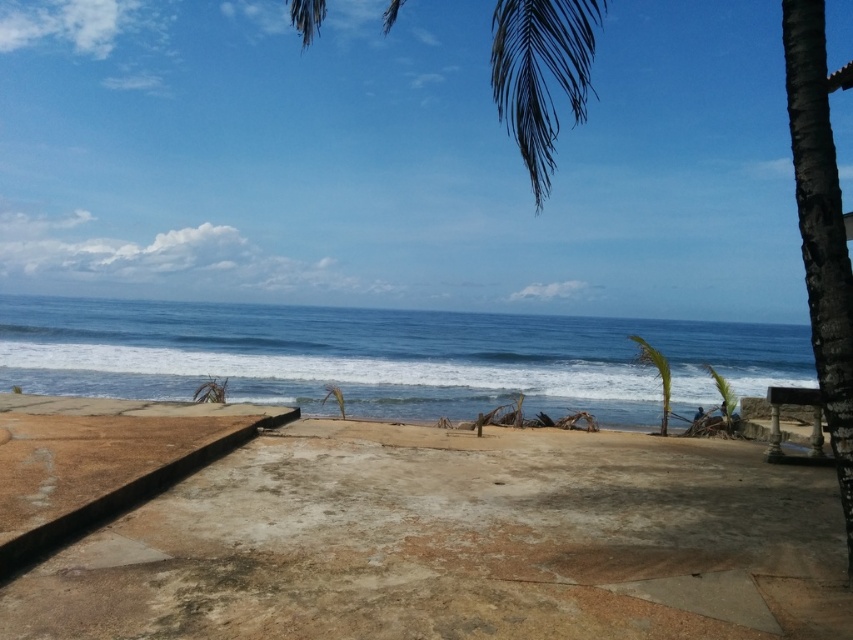
You are standing on the paved walkway in the coastal scene. You want to place a 2.5 meter long bench so that it faces the ocean. The bench needs to be placed between the green leafy palm tree at upper right and the low wall on the left. Is there enough space for the bench?

The distance between the green leafy palm tree at upper right and the viewer is 3.29 meters. Since the bench is 2.5 meters long, there is sufficient space to place it between them as long as the total available space between the palm tree and the wall is at least 2.5 meters. However, the given information only specifies the distance from the palm tree to the viewer, not the distance between the palm tree and the wall. Therefore, we cannot definitively confirm if there is enough space without knowing the gap